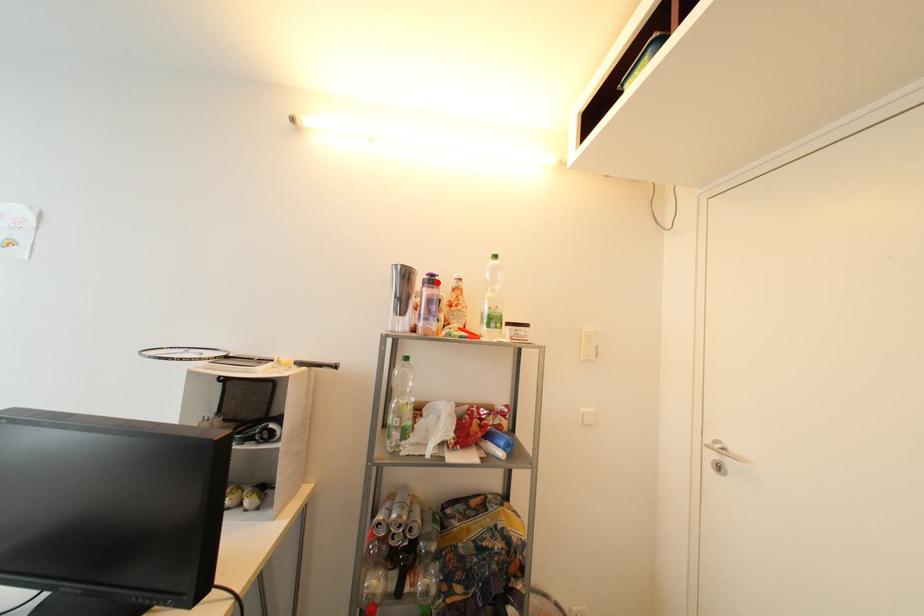
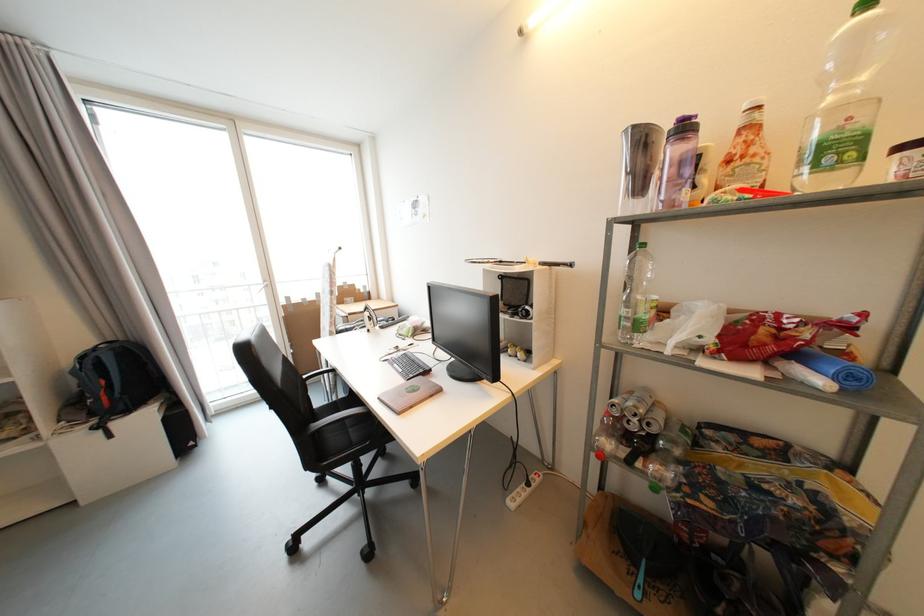
In the second image, find the point that corresponds to the highlighted location in the first image.

(689, 130)